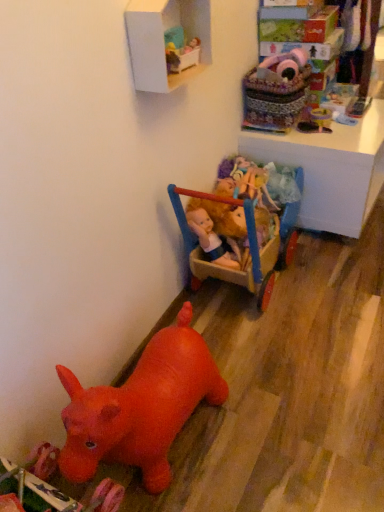
Locate an element on the screen. plush fabric dolls at upper center, which is the 3th toy in bottom-to-top order is located at coordinates (180, 50).

The width and height of the screenshot is (384, 512). What do you see at coordinates (276, 91) in the screenshot?
I see `velvet pink plush at upper right, which is the fourth toy from bottom to top` at bounding box center [276, 91].

Image resolution: width=384 pixels, height=512 pixels. Describe the element at coordinates (283, 66) in the screenshot. I see `pink plush toy at upper right, the 5th toy from the bottom` at that location.

The height and width of the screenshot is (512, 384). Find the location of `wooden doll carriage at upper right`. wooden doll carriage at upper right is located at coordinates (330, 169).

The width and height of the screenshot is (384, 512). I want to click on plush fabric dolls at upper center, marked as the 3th toy in a top-to-bottom arrangement, so click(180, 50).

Would you say white matte shelf at upper center is outside rubber red horse at lower left, which ranks as the 5th toy in top-to-bottom order?

Yes, white matte shelf at upper center is located beyond the bounds of rubber red horse at lower left, which ranks as the 5th toy in top-to-bottom order.

How distant is white matte shelf at upper center from rubber red horse at lower left, acting as the 1th toy starting from the bottom?

white matte shelf at upper center and rubber red horse at lower left, acting as the 1th toy starting from the bottom, are 1.05 meters apart.

From the image's perspective, which is above, white matte shelf at upper center or rubber red horse at lower left, acting as the 1th toy starting from the bottom?

white matte shelf at upper center is shown above in the image.

Between white matte shelf at upper center and rubber red horse at lower left, which ranks as the 5th toy in top-to-bottom order, which one appears on the left side from the viewer's perspective?

Positioned to the left is rubber red horse at lower left, which ranks as the 5th toy in top-to-bottom order.

Is rubber red horse at lower left, acting as the 1th toy starting from the bottom, inside or outside of rubber red hippo at lower left, arranged as the 2th toy when ordered from the bottom?

rubber red horse at lower left, acting as the 1th toy starting from the bottom, exists outside the volume of rubber red hippo at lower left, arranged as the 2th toy when ordered from the bottom.

What's the angular difference between rubber red horse at lower left, which ranks as the 5th toy in top-to-bottom order, and rubber red hippo at lower left, arranged as the 2th toy when ordered from the bottom,'s facing directions?

The angle between the facing direction of rubber red horse at lower left, which ranks as the 5th toy in top-to-bottom order, and the facing direction of rubber red hippo at lower left, arranged as the 2th toy when ordered from the bottom, is 0.000417 degrees.

From the picture: From a real-world perspective, is rubber red horse at lower left, which ranks as the 5th toy in top-to-bottom order, positioned under rubber red hippo at lower left, placed as the 4th toy when sorted from top to bottom, based on gravity?

No, from a real-world perspective, rubber red horse at lower left, which ranks as the 5th toy in top-to-bottom order, is not below rubber red hippo at lower left, placed as the 4th toy when sorted from top to bottom.

Are rubber red horse at lower left, which ranks as the 5th toy in top-to-bottom order, and rubber red hippo at lower left, arranged as the 2th toy when ordered from the bottom, beside each other?

No, rubber red horse at lower left, which ranks as the 5th toy in top-to-bottom order, is not in contact with rubber red hippo at lower left, arranged as the 2th toy when ordered from the bottom.

Is point (306, 201) farther from viewer compared to point (44, 509)?

Yes, it is.

From a real-world perspective, relative to rubber red horse at lower left, which ranks as the 5th toy in top-to-bottom order, is wooden doll carriage at upper right vertically above or below?

wooden doll carriage at upper right is below rubber red horse at lower left, which ranks as the 5th toy in top-to-bottom order.

From the image's perspective, starting from the wooden doll carriage at upper right, which toy is the 2nd one below? Please provide its 2D coordinates.

[(49, 488)]

Can you confirm if wooden doll carriage at upper right is shorter than rubber red horse at lower left, which ranks as the 5th toy in top-to-bottom order?

Indeed, wooden doll carriage at upper right has a lesser height compared to rubber red horse at lower left, which ranks as the 5th toy in top-to-bottom order.

Which of these two, plush fabric dolls at upper center, which is the 3th toy in bottom-to-top order, or pink plush toy at upper right, the 5th toy from the bottom, is bigger?

pink plush toy at upper right, the 5th toy from the bottom, is bigger.

Locate an element on the screen. This screenshot has height=512, width=384. toy above the pink plush toy at upper right, which is the 1th toy from top to bottom (from a real-world perspective) is located at coordinates (180, 50).

Is point (176, 50) less distant than point (306, 56)?

Yes, point (176, 50) is closer to viewer.

From the image's perspective, is plush fabric dolls at upper center, which is the 3th toy in bottom-to-top order, positioned above or below pink plush toy at upper right, which is the 1th toy from top to bottom?

From the image's perspective, plush fabric dolls at upper center, which is the 3th toy in bottom-to-top order, appears below pink plush toy at upper right, which is the 1th toy from top to bottom.

From the picture: Is velvet pink plush at upper right, which is the second toy in top-to-bottom order, to the left of wooden doll carriage at upper right from the viewer's perspective?

Correct, you'll find velvet pink plush at upper right, which is the second toy in top-to-bottom order, to the left of wooden doll carriage at upper right.

From a real-world perspective, which is physically below, velvet pink plush at upper right, which is the fourth toy from bottom to top, or wooden doll carriage at upper right?

From a 3D spatial view, wooden doll carriage at upper right is below.

From the image's perspective, between velvet pink plush at upper right, which is the second toy in top-to-bottom order, and wooden doll carriage at upper right, which one is located above?

velvet pink plush at upper right, which is the second toy in top-to-bottom order, appears higher in the image.

Is velvet pink plush at upper right, which is the second toy in top-to-bottom order, positioned with its back to wooden doll carriage at upper right?

That's not correct — velvet pink plush at upper right, which is the second toy in top-to-bottom order, is not looking away from wooden doll carriage at upper right.

Considering the relative positions of rubber red horse at lower left, acting as the 1th toy starting from the bottom, and velvet pink plush at upper right, which is the second toy in top-to-bottom order, in the image provided, is rubber red horse at lower left, acting as the 1th toy starting from the bottom, to the left or to the right of velvet pink plush at upper right, which is the second toy in top-to-bottom order,?

In the image, rubber red horse at lower left, acting as the 1th toy starting from the bottom, appears on the left side of velvet pink plush at upper right, which is the second toy in top-to-bottom order.

You are a GUI agent. You are given a task and a screenshot of the screen. Output one action in this format:
    pyautogui.click(x=<x>, y=<y>)
    Task: Click on the 3rd toy in front of the velvet pink plush at upper right, which is the fourth toy from bottom to top, counting from the anchor's position
    The image size is (384, 512).
    Given the screenshot: What is the action you would take?
    pyautogui.click(x=49, y=488)

Is rubber red horse at lower left, which ranks as the 5th toy in top-to-bottom order, far from velvet pink plush at upper right, which is the fourth toy from bottom to top?

Yes.

Is velvet pink plush at upper right, which is the fourth toy from bottom to top, at the back of rubber red horse at lower left, which ranks as the 5th toy in top-to-bottom order?

No, velvet pink plush at upper right, which is the fourth toy from bottom to top, is not at the back of rubber red horse at lower left, which ranks as the 5th toy in top-to-bottom order.

Consider the image. From the image's perspective, is plush fabric dolls at upper center, marked as the 3th toy in a top-to-bottom arrangement, above or below wooden doll carriage at upper right?

plush fabric dolls at upper center, marked as the 3th toy in a top-to-bottom arrangement, is above wooden doll carriage at upper right.

From their relative heights in the image, would you say plush fabric dolls at upper center, marked as the 3th toy in a top-to-bottom arrangement, is taller or shorter than wooden doll carriage at upper right?

Considering their sizes, plush fabric dolls at upper center, marked as the 3th toy in a top-to-bottom arrangement, has less height than wooden doll carriage at upper right.

Is the surface of plush fabric dolls at upper center, marked as the 3th toy in a top-to-bottom arrangement, in direct contact with wooden doll carriage at upper right?

No, plush fabric dolls at upper center, marked as the 3th toy in a top-to-bottom arrangement, is not with wooden doll carriage at upper right.

Considering the relative sizes of plush fabric dolls at upper center, which is the 3th toy in bottom-to-top order, and wooden doll carriage at upper right in the image provided, is plush fabric dolls at upper center, which is the 3th toy in bottom-to-top order, smaller than wooden doll carriage at upper right?

Yes.

Locate an element on the screen. shelf that appears above the rubber red horse at lower left, which ranks as the 5th toy in top-to-bottom order (from a real-world perspective) is located at coordinates (163, 40).

Image resolution: width=384 pixels, height=512 pixels. Find the location of `toy beneath the rubber red horse at lower left, which ranks as the 5th toy in top-to-bottom order (from a real-world perspective)`. toy beneath the rubber red horse at lower left, which ranks as the 5th toy in top-to-bottom order (from a real-world perspective) is located at coordinates (140, 407).

Estimate the real-world distances between objects in this image. Which object is further from plush fabric dolls at upper center, marked as the 3th toy in a top-to-bottom arrangement, velvet pink plush at upper right, which is the fourth toy from bottom to top, or rubber red hippo at lower left, placed as the 4th toy when sorted from top to bottom?

rubber red hippo at lower left, placed as the 4th toy when sorted from top to bottom, is further to plush fabric dolls at upper center, marked as the 3th toy in a top-to-bottom arrangement.

Consider the image. Considering their positions, is plush fabric dolls at upper center, marked as the 3th toy in a top-to-bottom arrangement, positioned closer to rubber red hippo at lower left, arranged as the 2th toy when ordered from the bottom, than rubber red horse at lower left, acting as the 1th toy starting from the bottom?

rubber red horse at lower left, acting as the 1th toy starting from the bottom, is closer to rubber red hippo at lower left, arranged as the 2th toy when ordered from the bottom.

Based on their spatial positions, is pink plush toy at upper right, the 5th toy from the bottom, or wooden doll carriage at upper right closer to white matte shelf at upper center?

pink plush toy at upper right, the 5th toy from the bottom, is positioned closer to the anchor white matte shelf at upper center.

Based on their spatial positions, is pink plush toy at upper right, the 5th toy from the bottom, or wooden doll carriage at upper right closer to velvet pink plush at upper right, which is the fourth toy from bottom to top?

pink plush toy at upper right, the 5th toy from the bottom, is closer to velvet pink plush at upper right, which is the fourth toy from bottom to top.

Looking at the image, which one is located closer to velvet pink plush at upper right, which is the fourth toy from bottom to top, rubber red horse at lower left, acting as the 1th toy starting from the bottom, or wooden doll carriage at upper right?

wooden doll carriage at upper right is closer to velvet pink plush at upper right, which is the fourth toy from bottom to top.

When comparing their distances from velvet pink plush at upper right, which is the second toy in top-to-bottom order, does white matte shelf at upper center or pink plush toy at upper right, which is the 1th toy from top to bottom, seem closer?

pink plush toy at upper right, which is the 1th toy from top to bottom.

Estimate the real-world distances between objects in this image. Which object is closer to rubber red hippo at lower left, placed as the 4th toy when sorted from top to bottom, plush fabric dolls at upper center, marked as the 3th toy in a top-to-bottom arrangement, or wooden doll carriage at upper right?

plush fabric dolls at upper center, marked as the 3th toy in a top-to-bottom arrangement, is positioned closer to the anchor rubber red hippo at lower left, placed as the 4th toy when sorted from top to bottom.

Looking at the image, which one is located closer to white matte shelf at upper center, plush fabric dolls at upper center, marked as the 3th toy in a top-to-bottom arrangement, or wooden doll carriage at upper right?

plush fabric dolls at upper center, marked as the 3th toy in a top-to-bottom arrangement, lies closer to white matte shelf at upper center than the other object.

This screenshot has height=512, width=384. I want to click on toy positioned between plush fabric dolls at upper center, which is the 3th toy in bottom-to-top order, and pink plush toy at upper right, the 5th toy from the bottom, from near to far, so click(276, 91).

Find the location of a particular element. The width and height of the screenshot is (384, 512). toy between white matte shelf at upper center and rubber red hippo at lower left, arranged as the 2th toy when ordered from the bottom, vertically is located at coordinates (180, 50).

The width and height of the screenshot is (384, 512). Find the location of `toy between white matte shelf at upper center and velvet pink plush at upper right, which is the second toy in top-to-bottom order, from front to back`. toy between white matte shelf at upper center and velvet pink plush at upper right, which is the second toy in top-to-bottom order, from front to back is located at coordinates (180, 50).

In order to click on shelf between pink plush toy at upper right, which is the 1th toy from top to bottom, and rubber red horse at lower left, acting as the 1th toy starting from the bottom, vertically in this screenshot , I will do `click(163, 40)`.